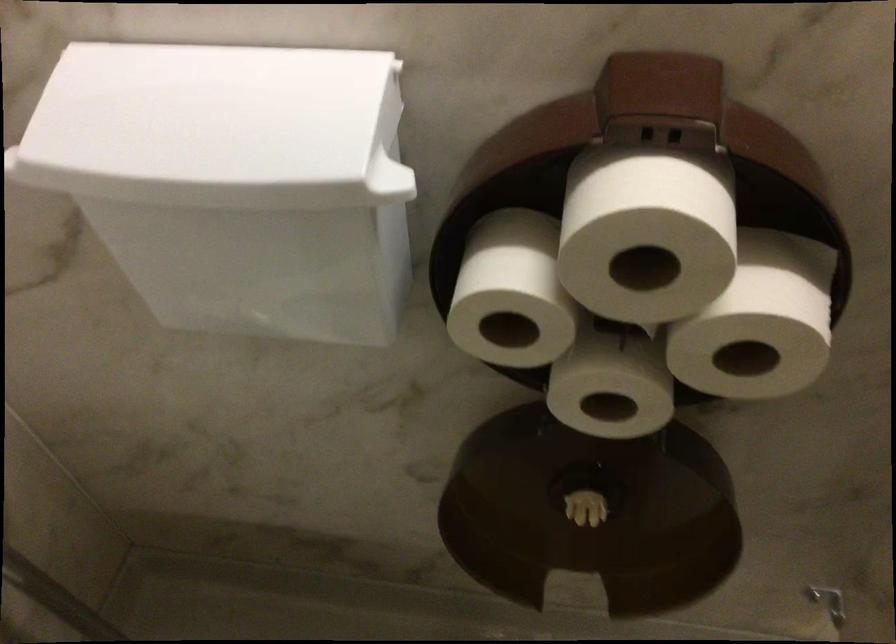
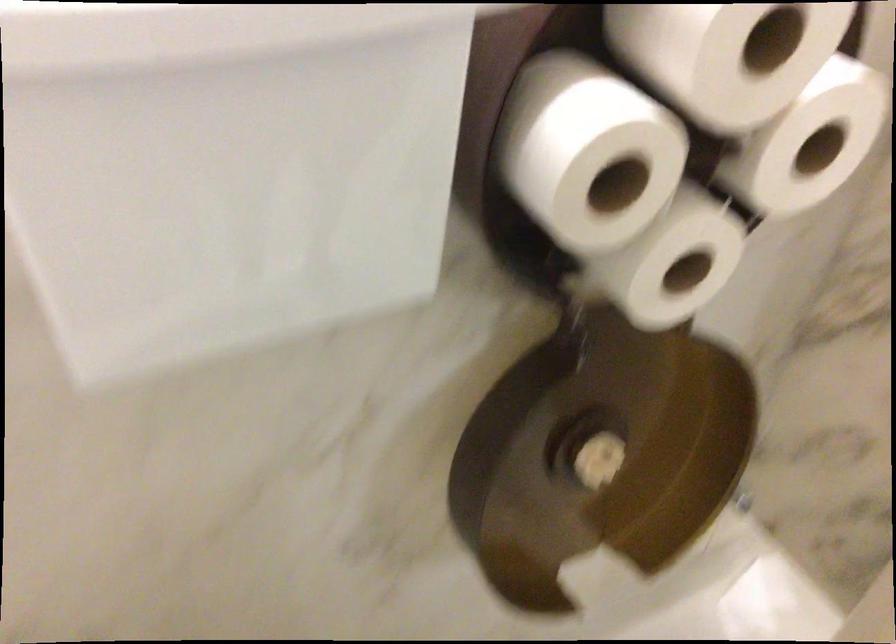
Locate, in the second image, the point that corresponds to point 615,263 in the first image.

(727, 55)